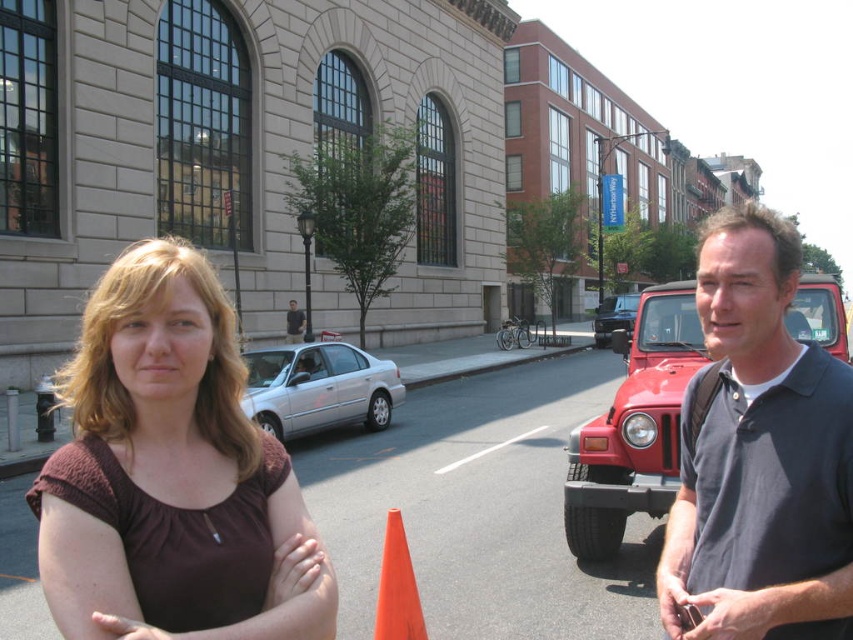
You are a photographer trying to capture both the dark gray polo shirt at right and the satin silver sedan at center in a single frame. Which object should you focus on first to ensure both are in focus?

The dark gray polo shirt at right is bigger than the satin silver sedan at center, so focusing on the larger object first will help ensure both are in focus.

You are a photographer standing in front of the dark gray polo shirt at right and the satin silver sedan at center. Which object is nearer to you?

The dark gray polo shirt at right is closer to the viewer than the satin silver sedan at center.